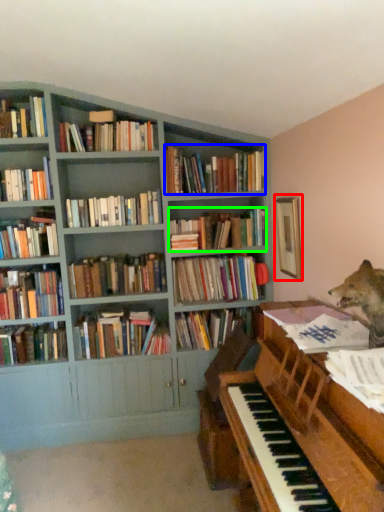
Question: Which object is the closest to the picture frame (highlighted by a red box)? Choose among these: book (highlighted by a blue box) or book (highlighted by a green box).

Choices:
 (A) book
 (B) book

Answer: (B)